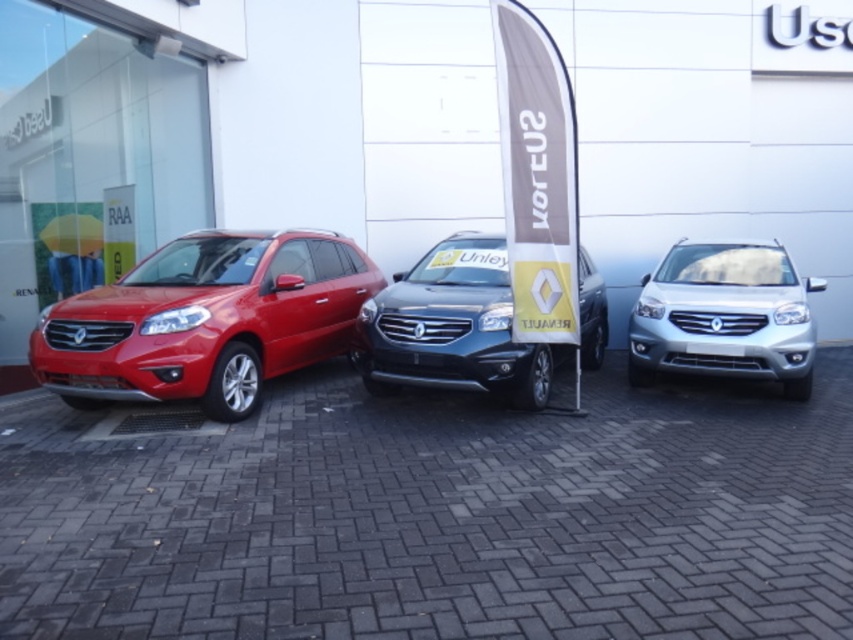
Question: Is matte red suv at left below silver metallic suv at center?

Choices:
 (A) yes
 (B) no

Answer: (B)

Question: Which point is farther to the camera?

Choices:
 (A) (705, 244)
 (B) (495, 305)

Answer: (A)

Question: Which object is farther from the camera taking this photo?

Choices:
 (A) matte red suv at left
 (B) silver metallic suv at center
 (C) satin metallic suv at center

Answer: (B)

Question: Does satin metallic suv at center have a lesser width compared to silver metallic suv at center?

Choices:
 (A) yes
 (B) no

Answer: (B)

Question: Does matte red suv at left appear on the left side of satin metallic suv at center?

Choices:
 (A) no
 (B) yes

Answer: (B)

Question: Which object is farther from the camera taking this photo?

Choices:
 (A) satin metallic suv at center
 (B) silver metallic suv at center

Answer: (B)